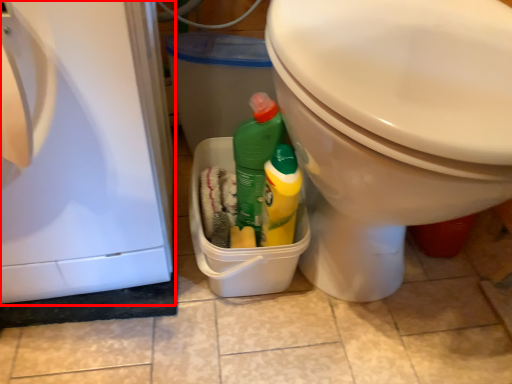
Question: From the image's perspective, considering the relative positions of dish washer (annotated by the red box) and toilet in the image provided, where is dish washer (annotated by the red box) located with respect to the staircase?

Choices:
 (A) below
 (B) above

Answer: (A)